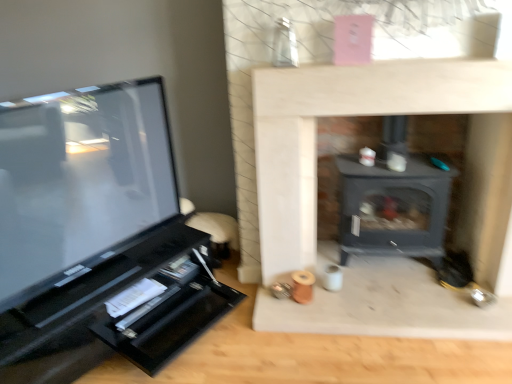
Locate an element on the screen. The width and height of the screenshot is (512, 384). matte black tv at left is located at coordinates (96, 235).

Describe the element at coordinates (96, 235) in the screenshot. I see `matte black tv at left` at that location.

Locate an element on the screen. matte black wood burning stove at center is located at coordinates (394, 200).

What do you see at coordinates (394, 200) in the screenshot? I see `matte black wood burning stove at center` at bounding box center [394, 200].

Where is `matte black tv at left`? The image size is (512, 384). matte black tv at left is located at coordinates (96, 235).

Considering the relative positions of matte black wood burning stove at center and matte black tv at left in the image provided, is matte black wood burning stove at center to the left of matte black tv at left from the viewer's perspective?

Incorrect, matte black wood burning stove at center is not on the left side of matte black tv at left.

Relative to matte black tv at left, is matte black wood burning stove at center in front or behind?

matte black wood burning stove at center is behind matte black tv at left.

Between point (414, 165) and point (46, 357), which one is positioned behind?

Point (414, 165)

From the image's perspective, is matte black wood burning stove at center located above or below matte black tv at left?

From the image's perspective, matte black wood burning stove at center appears above matte black tv at left.

From a real-world perspective, which object rests below the other?

From a 3D spatial view, matte black wood burning stove at center is below.

Which of these two, matte black wood burning stove at center or matte black tv at left, is wider?

matte black wood burning stove at center is wider.

Does matte black wood burning stove at center have a greater height compared to matte black tv at left?

Yes, matte black wood burning stove at center is taller than matte black tv at left.

Considering the sizes of objects matte black wood burning stove at center and matte black tv at left in the image provided, who is bigger, matte black wood burning stove at center or matte black tv at left?

With larger size is matte black tv at left.

From the picture: Is matte black wood burning stove at center inside the boundaries of matte black tv at left, or outside?

matte black wood burning stove at center exists outside the volume of matte black tv at left.

Is the surface of matte black wood burning stove at center in direct contact with matte black tv at left?

No, matte black wood burning stove at center is not with matte black tv at left.

Is matte black wood burning stove at center turned away from matte black tv at left?

No, matte black wood burning stove at center is not facing the opposite direction of matte black tv at left.

Find the location of a particular element. Image resolution: width=512 pixels, height=384 pixels. wood burning stove above the matte black tv at left (from the image's perspective) is located at coordinates (394, 200).

Considering the relative positions of matte black tv at left and matte black wood burning stove at center in the image provided, is matte black tv at left to the left or to the right of matte black wood burning stove at center?

From the image, it's evident that matte black tv at left is to the left of matte black wood burning stove at center.

Who is more distant, matte black tv at left or matte black wood burning stove at center?

matte black wood burning stove at center is more distant.

Considering the positions of point (89, 146) and point (448, 191), is point (89, 146) closer or farther from the camera than point (448, 191)?

Point (89, 146) appears to be farther away from the viewer than point (448, 191).

From the image's perspective, is matte black tv at left on top of matte black wood burning stove at center?

No, from the image's perspective, matte black tv at left is not over matte black wood burning stove at center.

From a real-world perspective, is matte black tv at left above or below matte black wood burning stove at center?

Clearly, from a real-world perspective, matte black tv at left is above matte black wood burning stove at center.

Considering the relative sizes of matte black tv at left and matte black wood burning stove at center in the image provided, is matte black tv at left wider than matte black wood burning stove at center?

Incorrect, the width of matte black tv at left does not surpass that of matte black wood burning stove at center.

Who is shorter, matte black tv at left or matte black wood burning stove at center?

matte black tv at left.

Is matte black tv at left smaller than matte black wood burning stove at center?

Incorrect, matte black tv at left is not smaller in size than matte black wood burning stove at center.

Is matte black tv at left spatially inside matte black wood burning stove at center, or outside of it?

matte black tv at left is located beyond the bounds of matte black wood burning stove at center.

Can you see matte black tv at left touching matte black wood burning stove at center?

No, matte black tv at left is not in contact with matte black wood burning stove at center.

Is matte black tv at left oriented away from matte black wood burning stove at center?

matte black tv at left does not have its back to matte black wood burning stove at center.

Measure the distance from matte black tv at left to matte black wood burning stove at center.

matte black tv at left is 3.71 feet from matte black wood burning stove at center.

At what (x,y) coordinates should I click in order to perform the action: click on entertainment center below the matte black wood burning stove at center (from the image's perspective). Please return your answer as a coordinate pair (x, y). Looking at the image, I should click on (96, 235).

Find the location of a particular element. wood burning stove below the matte black tv at left (from a real-world perspective) is located at coordinates (394, 200).

Locate an element on the screen. wood burning stove behind the matte black tv at left is located at coordinates (394, 200).